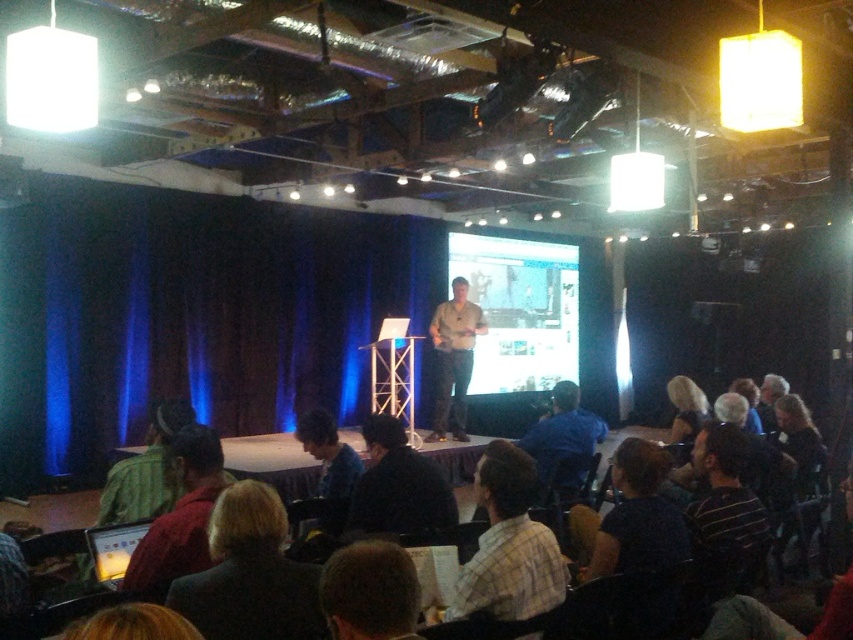
Question: Among these objects, which one is farthest from the camera?

Choices:
 (A) blue shirt at center
 (B) khaki cotton shirt at center

Answer: (B)

Question: Estimate the real-world distances between objects in this image. Which object is farther from the blue shirt at center?

Choices:
 (A) dark brown suit at lower center
 (B) plaid shirt at center
 (C) blue fabric shirt at lower center

Answer: (A)

Question: Does dark blue shirt at center lie in front of light brown hair at upper right?

Choices:
 (A) no
 (B) yes

Answer: (B)

Question: Which object appears closest to the camera in this image?

Choices:
 (A) khaki cotton shirt at center
 (B) blue fabric shirt at lower center
 (C) blue velvet curtain at left
 (D) plaid shirt at center

Answer: (D)

Question: Is red shirt at lower left above khaki cotton shirt at center?

Choices:
 (A) yes
 (B) no

Answer: (B)

Question: Can you confirm if matte white screen at center is bigger than dark brown suit at lower center?

Choices:
 (A) yes
 (B) no

Answer: (A)